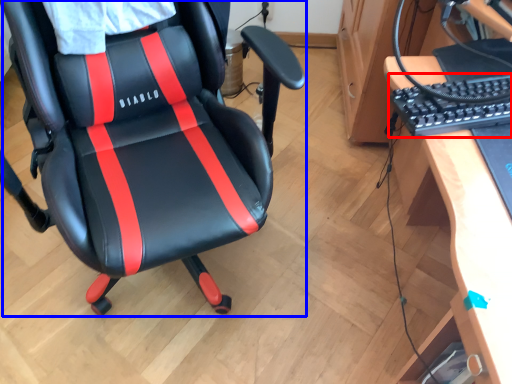
Question: Which point is closer to the camera, computer keyboard (highlighted by a red box) or chair (highlighted by a blue box)?

Choices:
 (A) computer keyboard
 (B) chair

Answer: (B)